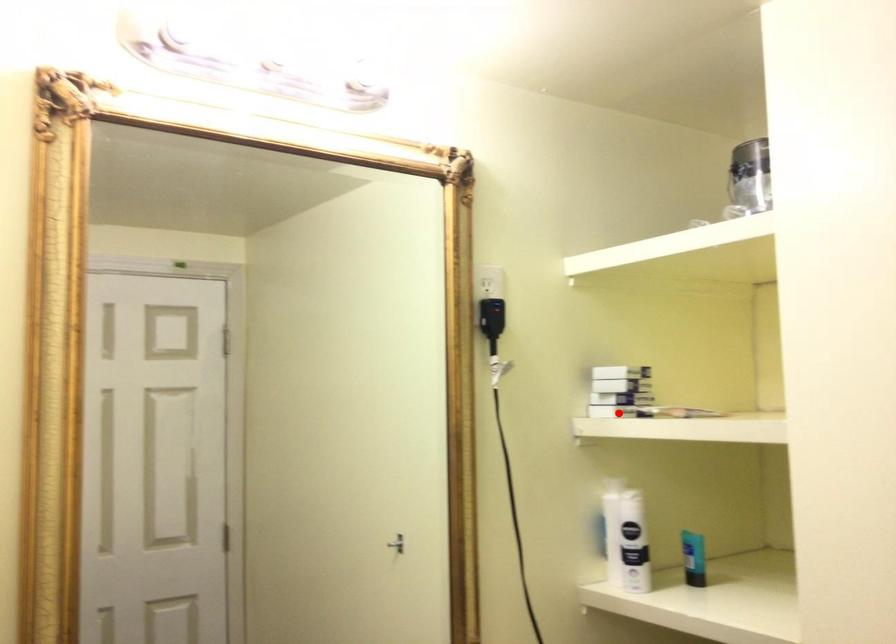
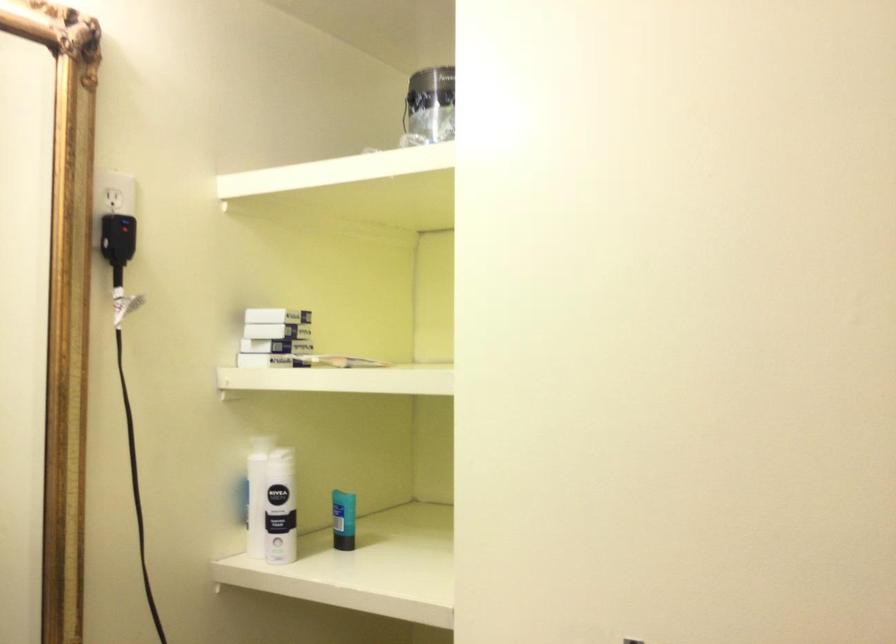
Find the pixel in the second image that matches the highlighted location in the first image.

(260, 362)